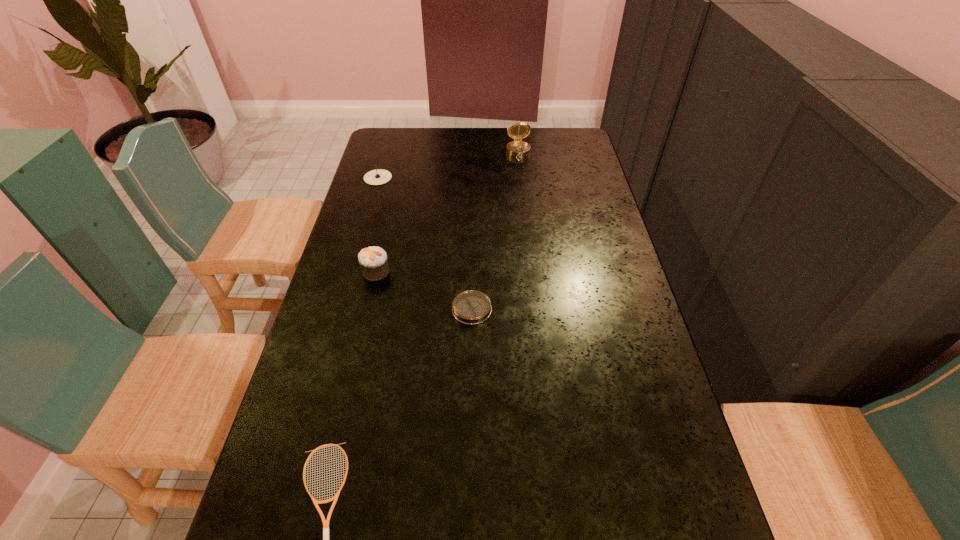
What are the coordinates of `the rightmost object` in the screenshot? It's located at (517, 148).

Image resolution: width=960 pixels, height=540 pixels. I want to click on the tallest compass, so click(517, 148).

Where is `the fourth shortest object`? the fourth shortest object is located at coordinates (373, 262).

The height and width of the screenshot is (540, 960). Find the location of `the third farthest object`. the third farthest object is located at coordinates (373, 262).

I want to click on the second farthest compass, so click(x=379, y=176).

At what (x,y) coordinates should I click in order to perform the action: click on the third tallest object. Please return your answer as a coordinate pair (x, y). Looking at the image, I should click on (379, 176).

Where is `the nearest compass`? the nearest compass is located at coordinates (471, 307).

Where is `the second compass from right to left`? the second compass from right to left is located at coordinates (471, 307).

The width and height of the screenshot is (960, 540). Find the location of `vacant space located 0.130m with the dial facing the rightmost compass`. vacant space located 0.130m with the dial facing the rightmost compass is located at coordinates (521, 179).

I want to click on vacant area situated on the left of the cupcake, so click(330, 272).